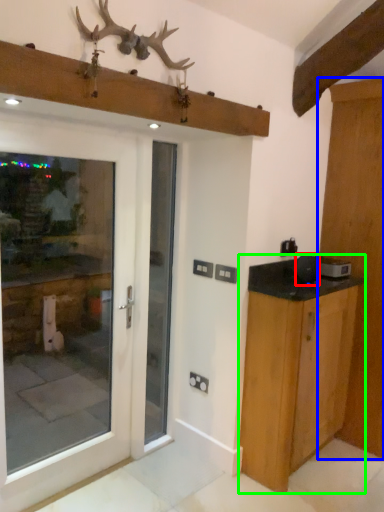
Question: Estimate the real-world distances between objects in this image. Which object is farther from appliance (highlighted by a red box), door (highlighted by a blue box) or cabinetry (highlighted by a green box)?

Choices:
 (A) door
 (B) cabinetry

Answer: (A)